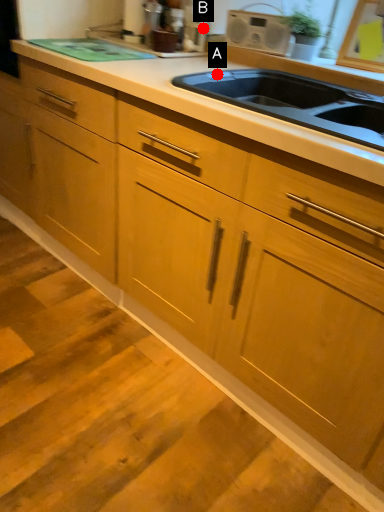
Question: Two points are circled on the image, labeled by A and B beside each circle. Which point is closer to the camera taking this photo?

Choices:
 (A) A is closer
 (B) B is closer

Answer: (A)